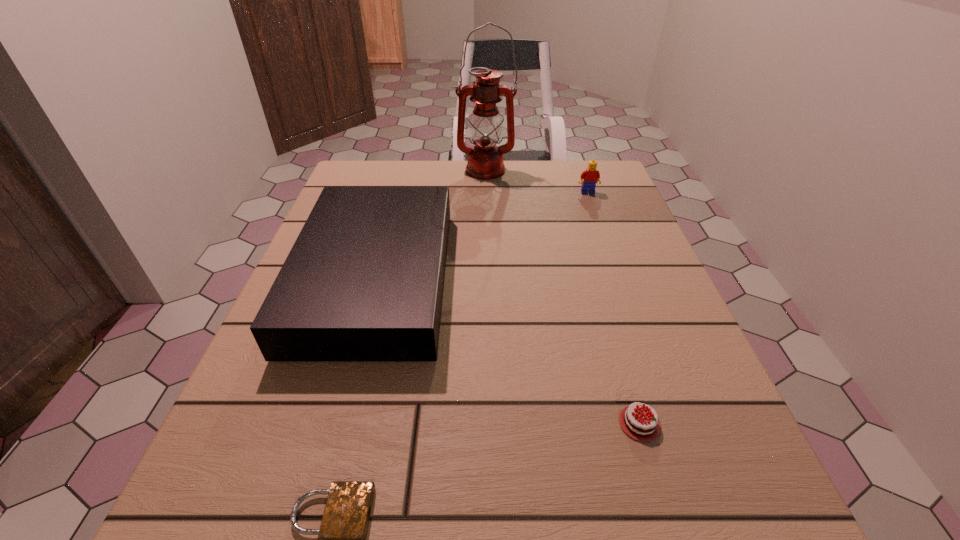
Locate an element on the screen. The height and width of the screenshot is (540, 960). oil lamp present at the far edge is located at coordinates (485, 161).

I want to click on Lego situated at the far edge, so click(591, 176).

Locate an element on the screen. object present at the left edge is located at coordinates (364, 280).

Locate an element on the screen. The image size is (960, 540). Lego that is positioned at the right edge is located at coordinates (591, 176).

You are a GUI agent. You are given a task and a screenshot of the screen. Output one action in this format:
    pyautogui.click(x=<x>, y=<y>)
    Task: Click on the chocolate cake positioned at the right edge
    This screenshot has width=960, height=540.
    Given the screenshot: What is the action you would take?
    pyautogui.click(x=637, y=425)

Find the location of a particular element. Image resolution: width=960 pixels, height=540 pixels. object present at the far right corner is located at coordinates (591, 176).

The width and height of the screenshot is (960, 540). In the image, there is a desktop. In order to click on free space at the far edge in this screenshot , I will do `click(507, 204)`.

You are a GUI agent. You are given a task and a screenshot of the screen. Output one action in this format:
    pyautogui.click(x=<x>, y=<y>)
    Task: Click on the free space at the near edge of the desktop
    This screenshot has width=960, height=540.
    Given the screenshot: What is the action you would take?
    pyautogui.click(x=435, y=492)

Find the location of `vacant space at the left edge of the desktop`. vacant space at the left edge of the desktop is located at coordinates (263, 483).

Find the location of a particular element. free space at the right edge of the desktop is located at coordinates (615, 327).